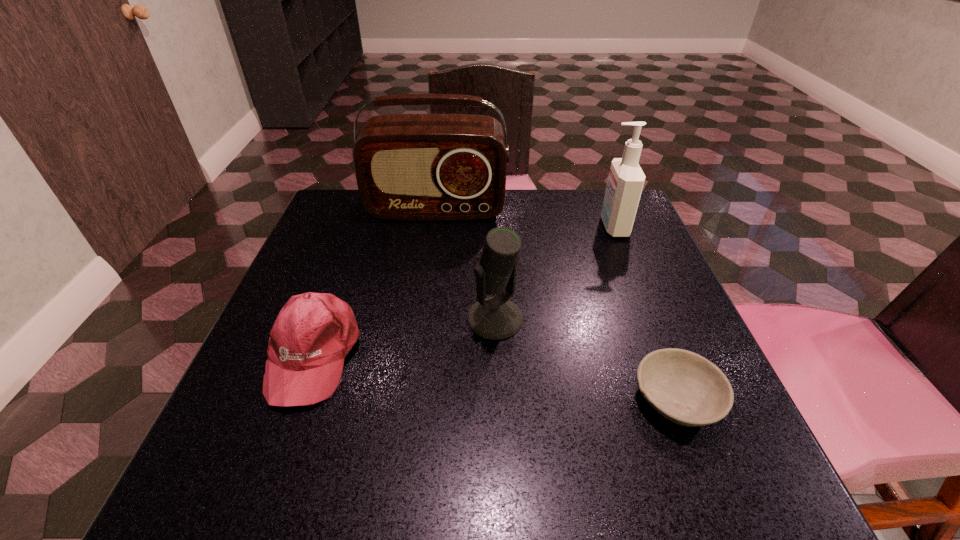
Where is `vacant space situated at the front of the fourth tallest object with the brim`? vacant space situated at the front of the fourth tallest object with the brim is located at coordinates (260, 503).

I want to click on vacant region located 0.300m on the left of the bowl, so click(x=450, y=399).

Identify the location of radio receiver located at the far edge. 417,167.

The width and height of the screenshot is (960, 540). What are the coordinates of `cleansing agent at the far edge` in the screenshot? It's located at (626, 179).

Where is `radio receiver located in the left edge section of the desktop`? radio receiver located in the left edge section of the desktop is located at coordinates (417, 167).

Find the location of a particular element. This screenshot has width=960, height=540. baseball cap situated at the left edge is located at coordinates (313, 333).

Where is `cleansing agent at the right edge`? Image resolution: width=960 pixels, height=540 pixels. cleansing agent at the right edge is located at coordinates (626, 179).

Where is `bowl at the right edge`? The height and width of the screenshot is (540, 960). bowl at the right edge is located at coordinates (684, 387).

At what (x,y) coordinates should I click in order to perform the action: click on object that is at the far left corner. Please return your answer as a coordinate pair (x, y). Image resolution: width=960 pixels, height=540 pixels. Looking at the image, I should click on (417, 167).

The height and width of the screenshot is (540, 960). Find the location of `object present at the far right corner`. object present at the far right corner is located at coordinates (626, 179).